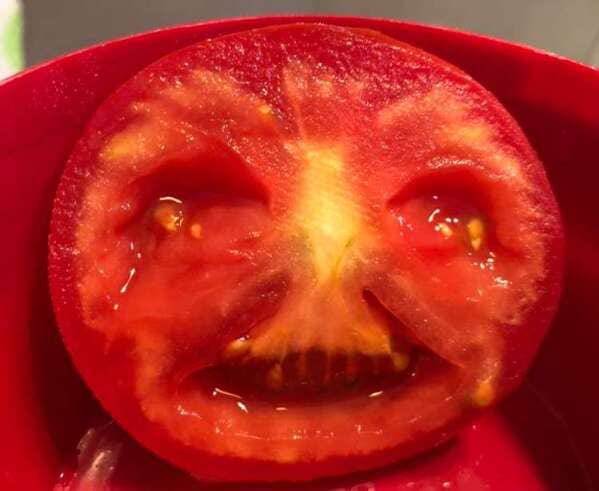
The height and width of the screenshot is (491, 599). I want to click on bottom of red bowl, so click(x=468, y=474).